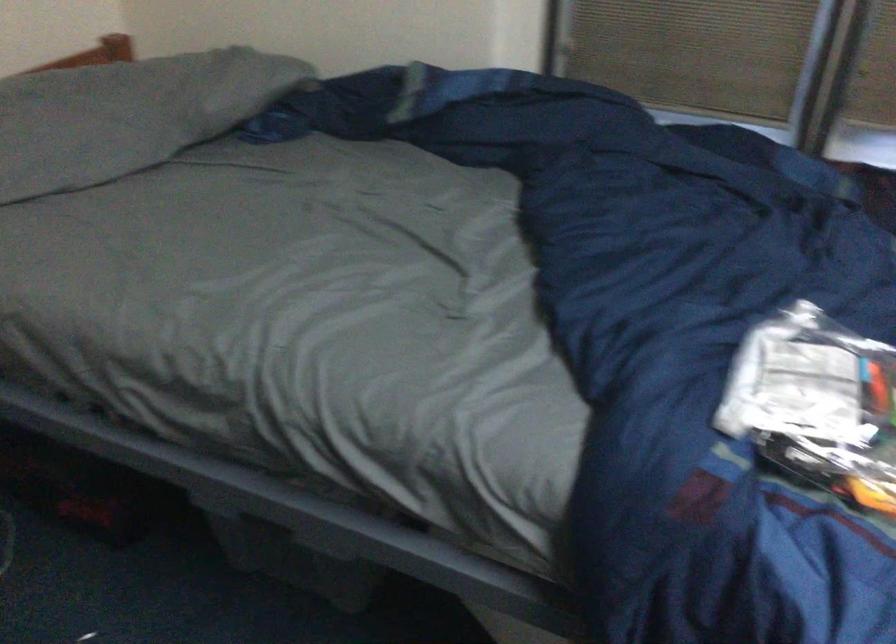
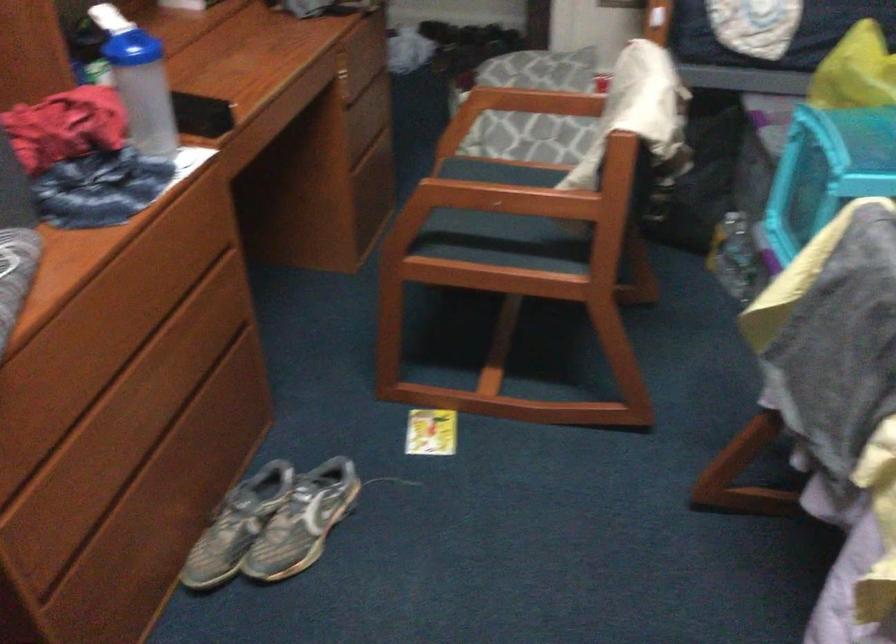
The first image is from the beginning of the video and the second image is from the end. How did the camera likely rotate when shooting the video?

The rotation direction of the camera is right-down.